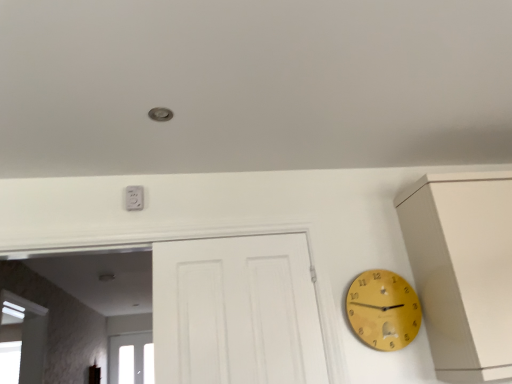
Question: Does transparent glass window at lower left appear on the left side of white plastic outlet at upper center?

Choices:
 (A) yes
 (B) no

Answer: (A)

Question: Would you say transparent glass window at lower left is outside white plastic outlet at upper center?

Choices:
 (A) no
 (B) yes

Answer: (B)

Question: Is transparent glass window at lower left far from white plastic outlet at upper center?

Choices:
 (A) yes
 (B) no

Answer: (A)

Question: From the image's perspective, would you say transparent glass window at lower left is shown under white plastic outlet at upper center?

Choices:
 (A) yes
 (B) no

Answer: (A)

Question: From the image's perspective, does transparent glass window at lower left appear higher than white plastic outlet at upper center?

Choices:
 (A) yes
 (B) no

Answer: (B)

Question: In the image, is white plastic outlet at upper center positioned in front of or behind yellow wooden clock at right?

Choices:
 (A) front
 (B) behind

Answer: (B)

Question: Based on their sizes in the image, would you say white plastic outlet at upper center is bigger or smaller than yellow wooden clock at right?

Choices:
 (A) small
 (B) big

Answer: (A)

Question: From a real-world perspective, is white plastic outlet at upper center above or below yellow wooden clock at right?

Choices:
 (A) below
 (B) above

Answer: (B)

Question: Is white plastic outlet at upper center taller or shorter than yellow wooden clock at right?

Choices:
 (A) short
 (B) tall

Answer: (A)

Question: Is white plastic outlet at upper center bigger or smaller than transparent glass window at lower left?

Choices:
 (A) big
 (B) small

Answer: (B)

Question: Considering their positions, is white plastic outlet at upper center located in front of or behind transparent glass window at lower left?

Choices:
 (A) front
 (B) behind

Answer: (A)

Question: In terms of height, does white plastic outlet at upper center look taller or shorter compared to transparent glass window at lower left?

Choices:
 (A) short
 (B) tall

Answer: (A)

Question: From a real-world perspective, relative to transparent glass window at lower left, is white plastic outlet at upper center vertically above or below?

Choices:
 (A) below
 (B) above

Answer: (B)

Question: Is transparent glass window at lower left spatially inside white plastic outlet at upper center, or outside of it?

Choices:
 (A) outside
 (B) inside

Answer: (A)

Question: Looking at their shapes, would you say transparent glass window at lower left is wider or thinner than white plastic outlet at upper center?

Choices:
 (A) wide
 (B) thin

Answer: (A)